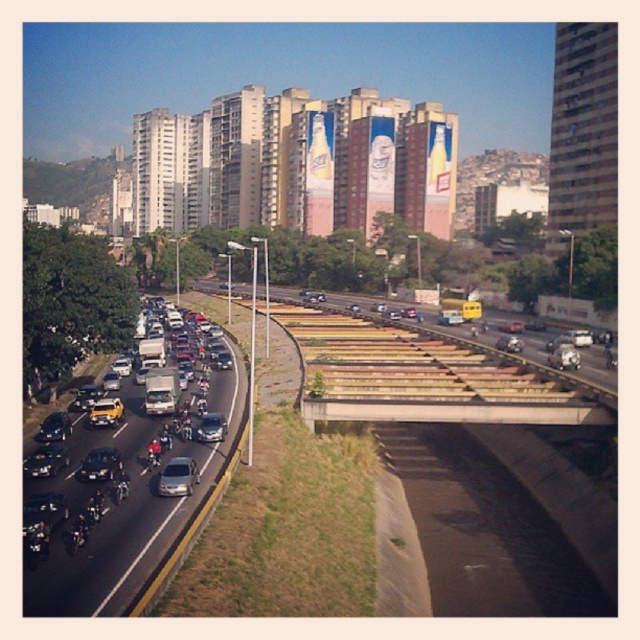
Question: Which point is closer to the camera?

Choices:
 (A) (204, 442)
 (B) (323, 416)

Answer: (A)

Question: Considering the relative positions of concrete at center and satin silver sedan at center in the image provided, where is concrete at center located with respect to satin silver sedan at center?

Choices:
 (A) below
 (B) above

Answer: (B)

Question: Does satin silver sedan at center appear over shiny silver sedan at center-left?

Choices:
 (A) yes
 (B) no

Answer: (B)

Question: Does silver metallic van at center-left have a larger size compared to shiny silver sedan at center?

Choices:
 (A) no
 (B) yes

Answer: (A)

Question: Estimate the real-world distances between objects in this image. Which object is farther from the shiny silver sedan at center-left?

Choices:
 (A) shiny silver sedan at center
 (B) concrete at center

Answer: (B)

Question: Which object is the closest to the satin silver sedan at center?

Choices:
 (A) metallic silver car at center-left
 (B) shiny silver sedan at center
 (C) shiny silver sedan at center-left

Answer: (C)